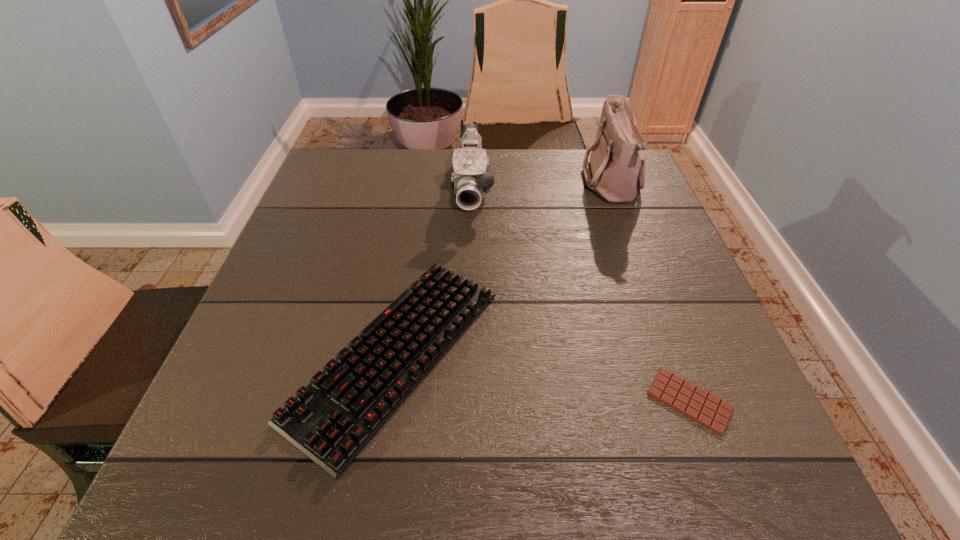
Locate an element on the screen. free space that satisfies the following two spatial constraints: 1. on the front-facing side of the shortest object; 2. on the left side of the camcorder is located at coordinates (467, 401).

Where is `blank space that satisfies the following two spatial constraints: 1. on the front side of the computer keyboard; 2. on the left side of the candy bar`? This screenshot has height=540, width=960. blank space that satisfies the following two spatial constraints: 1. on the front side of the computer keyboard; 2. on the left side of the candy bar is located at coordinates (389, 401).